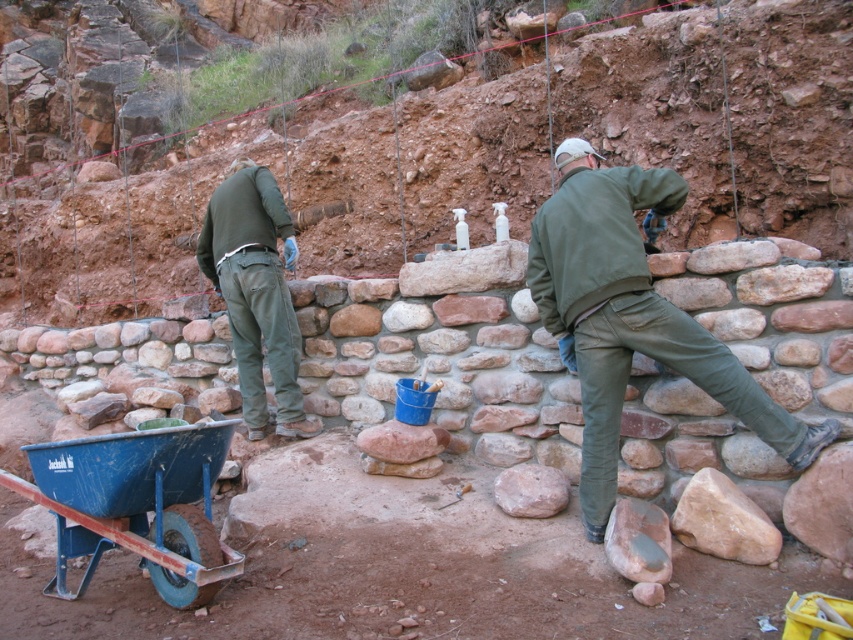
Question: Estimate the real-world distances between objects in this image. Which object is closer to the green matte pants at center?

Choices:
 (A) blue plastic cart at lower left
 (B) green matte jacket at center

Answer: (A)

Question: Is green matte jacket at center smaller than green matte pants at center?

Choices:
 (A) no
 (B) yes

Answer: (A)

Question: Does green matte jacket at center have a greater width compared to green matte pants at center?

Choices:
 (A) yes
 (B) no

Answer: (A)

Question: Estimate the real-world distances between objects in this image. Which object is farther from the green matte pants at center?

Choices:
 (A) blue plastic cart at lower left
 (B) green matte jacket at center

Answer: (B)

Question: Does green matte jacket at center appear on the right side of green matte pants at center?

Choices:
 (A) no
 (B) yes

Answer: (B)

Question: Which point appears farthest from the camera in this image?

Choices:
 (A) (259, 381)
 (B) (155, 497)
 (C) (737, 374)

Answer: (A)